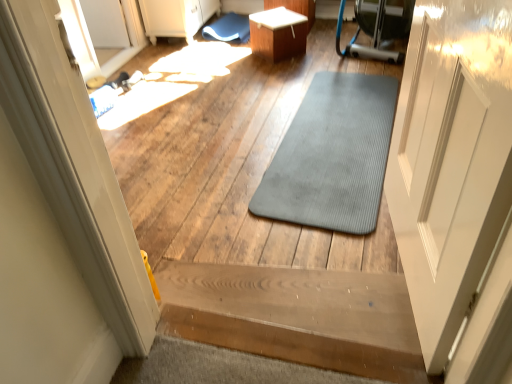
The height and width of the screenshot is (384, 512). In order to click on vacant region above wooden stairs at center (from a real-world perspective) in this screenshot , I will do `click(297, 296)`.